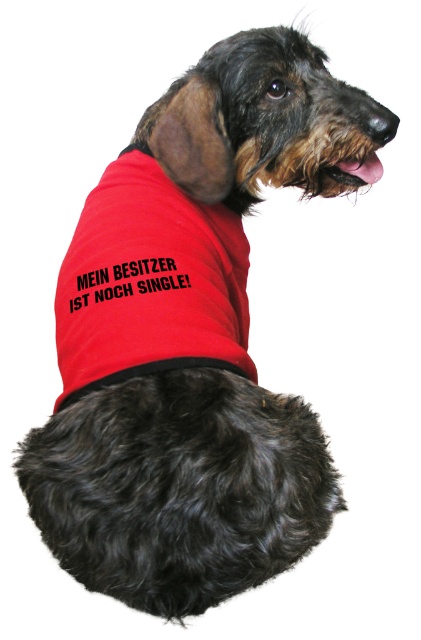
Does point (109, 595) lie behind point (220, 260)?

That is False.

Who is more distant from viewer, (319, 458) or (152, 316)?

Point (152, 316)

What are the coordinates of `black furry head at upper center` in the screenshot? It's located at (178, 486).